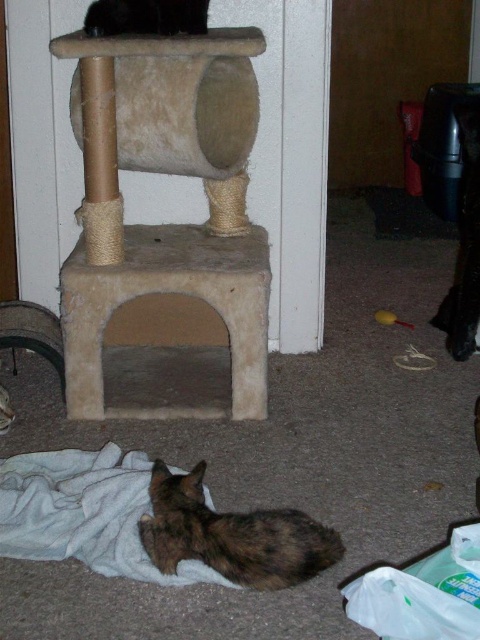
Question: Which object is farther from the camera taking this photo?

Choices:
 (A) black fur cat at upper center
 (B) brown fur cat at lower center

Answer: (A)

Question: Which point is farther to the camera?

Choices:
 (A) brown fur cat at lower center
 (B) black fur cat at upper center

Answer: (B)

Question: Is brown fur cat at lower center positioned at the back of black fur cat at upper center?

Choices:
 (A) no
 (B) yes

Answer: (A)

Question: Which point is farther to the camera?

Choices:
 (A) brown fur cat at lower center
 (B) black fur cat at upper center

Answer: (B)

Question: Does brown fur cat at lower center appear on the right side of black fur cat at upper center?

Choices:
 (A) yes
 (B) no

Answer: (A)

Question: Does brown fur cat at lower center have a smaller size compared to black fur cat at upper center?

Choices:
 (A) no
 (B) yes

Answer: (A)